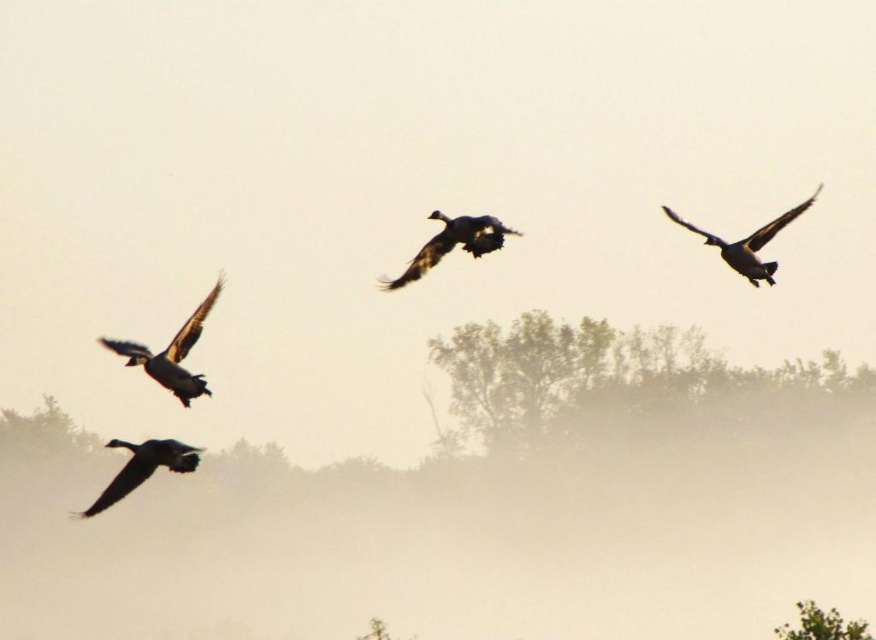
How much distance is there between green leafy trees at lower center and dark gray feathers at lower left?

green leafy trees at lower center is 242.90 feet from dark gray feathers at lower left.

Based on the photo, how far apart are green leafy trees at lower center and dark gray feathers at lower left?

green leafy trees at lower center and dark gray feathers at lower left are 74.04 meters apart from each other.

Locate an element on the screen. The image size is (876, 640). green leafy trees at lower center is located at coordinates (605, 376).

Where is `green leafy trees at lower center`? green leafy trees at lower center is located at coordinates (605, 376).

Can you confirm if dark gray feathers at center is thinner than dark gray feathers at lower left?

Correct, dark gray feathers at center's width is less than dark gray feathers at lower left's.

Is dark gray feathers at center taller than dark gray feathers at lower left?

No.

Is point (474, 227) farther from camera compared to point (107, 506)?

Yes, it is.

Find the location of a particular element. dark gray feathers at center is located at coordinates (453, 243).

Who is positioned more to the left, green leafy trees at lower center or dark gray feathers at left?

From the viewer's perspective, dark gray feathers at left appears more on the left side.

Does point (485, 401) lie behind point (214, 285)?

Yes, point (485, 401) is behind point (214, 285).

Where is `green leafy trees at lower center`? The image size is (876, 640). green leafy trees at lower center is located at coordinates (605, 376).